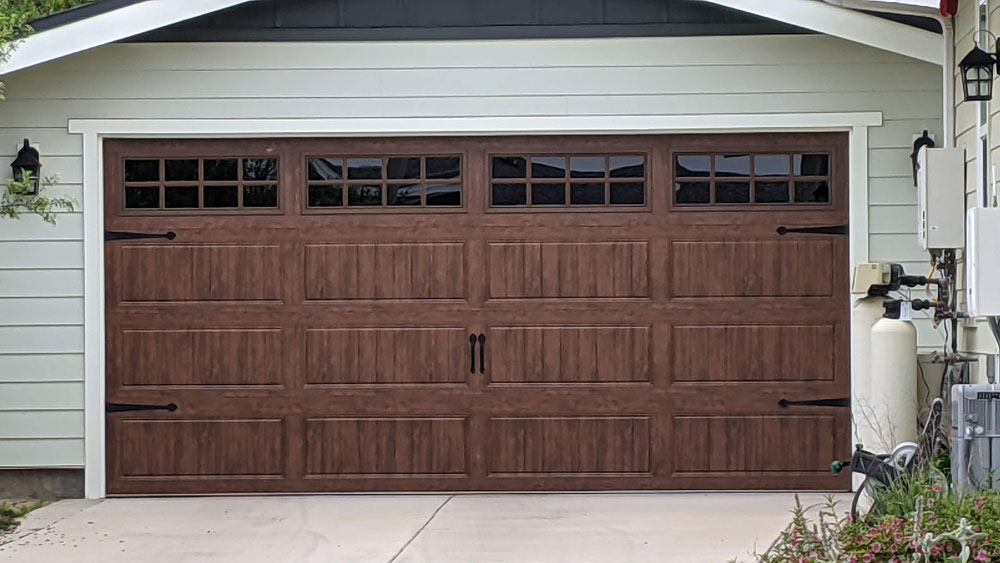
The height and width of the screenshot is (563, 1000). Find the location of `decorative trim`. decorative trim is located at coordinates (108, 234), (117, 406), (821, 227), (838, 402).